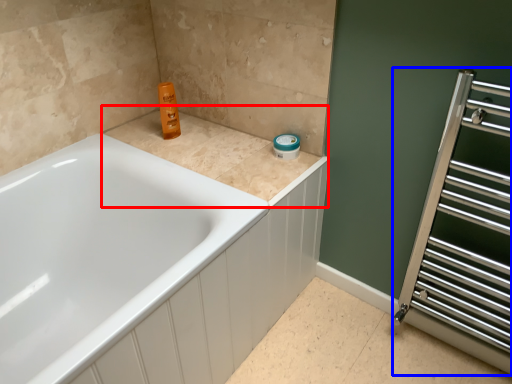
Question: Which of the following is the closest to the observer, counter top (highlighted by a red box) or screen door (highlighted by a blue box)?

Choices:
 (A) counter top
 (B) screen door

Answer: (B)